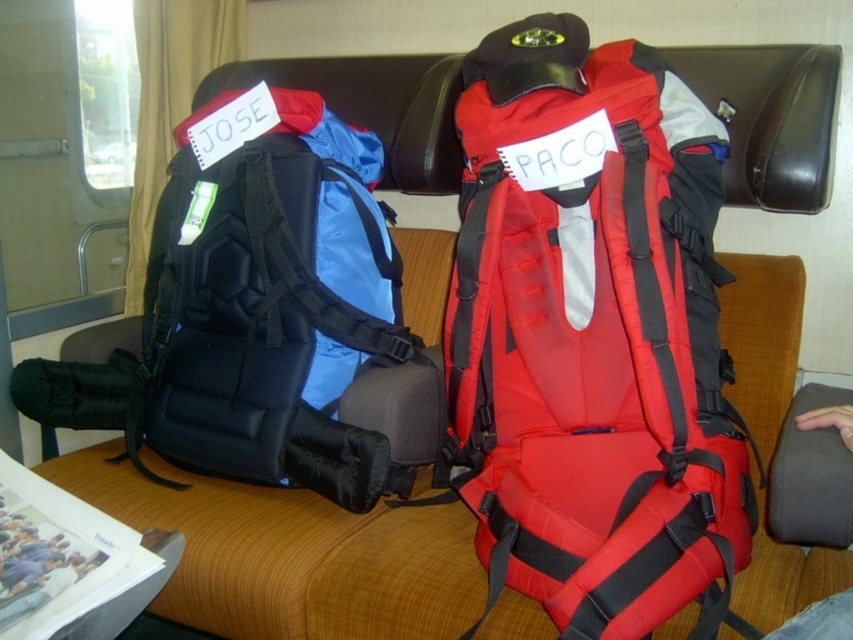
Question: Does matte red backpack at center appear over matte black backpack at left?

Choices:
 (A) yes
 (B) no

Answer: (B)

Question: Is matte red backpack at center above matte black backpack at left?

Choices:
 (A) yes
 (B) no

Answer: (B)

Question: Can you confirm if matte red backpack at center is bigger than matte black backpack at left?

Choices:
 (A) no
 (B) yes

Answer: (B)

Question: Which object is closer to the camera taking this photo?

Choices:
 (A) matte red backpack at center
 (B) matte black backpack at left

Answer: (A)

Question: Among these objects, which one is nearest to the camera?

Choices:
 (A) matte black backpack at left
 (B) matte red backpack at center

Answer: (B)